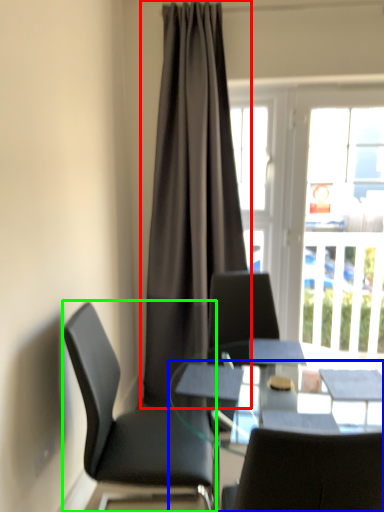
Question: Considering the real-world distances, which object is closest to curtain (highlighted by a red box)? desk (highlighted by a blue box) or chair (highlighted by a green box).

Choices:
 (A) desk
 (B) chair

Answer: (B)